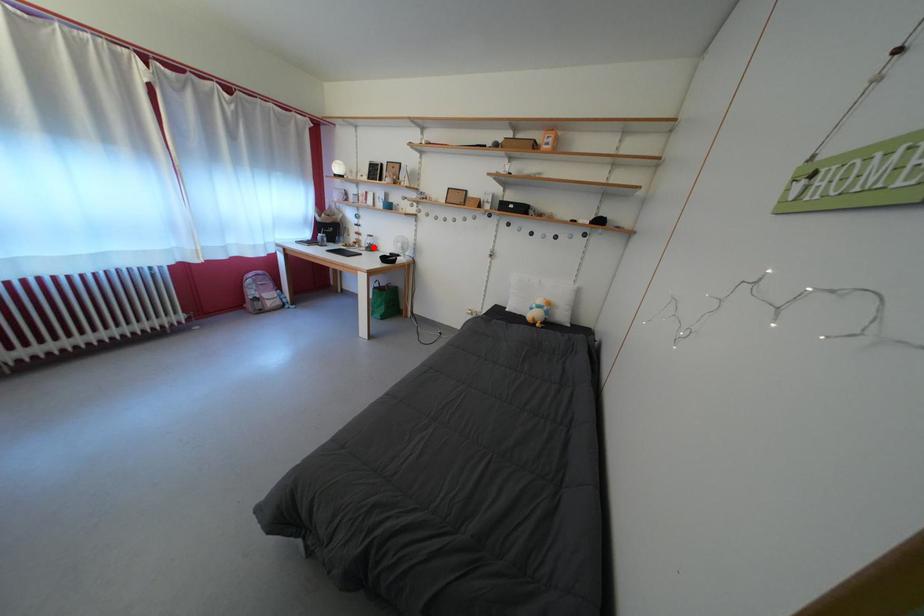
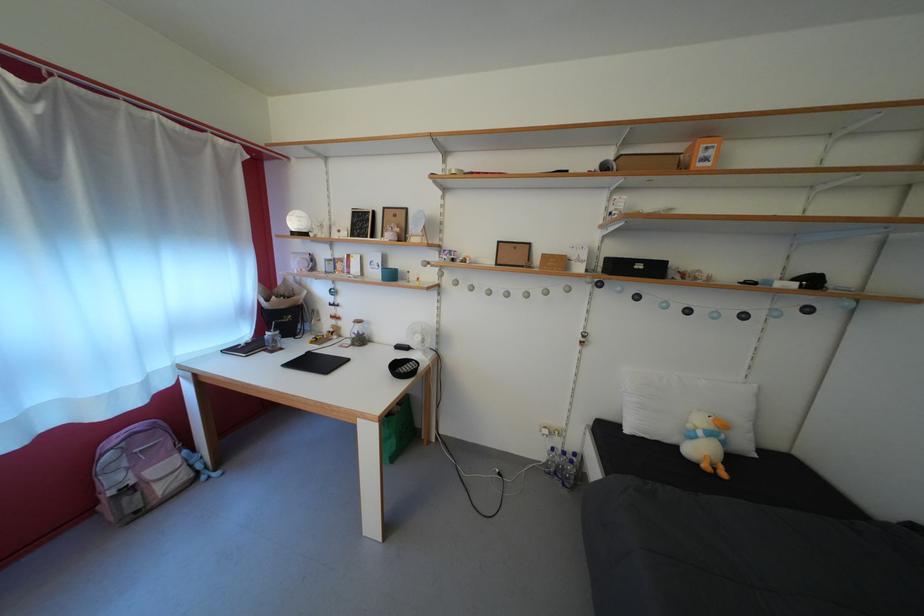
Locate, in the second image, the point that corresponds to the highlighted location in the first image.

(358, 334)